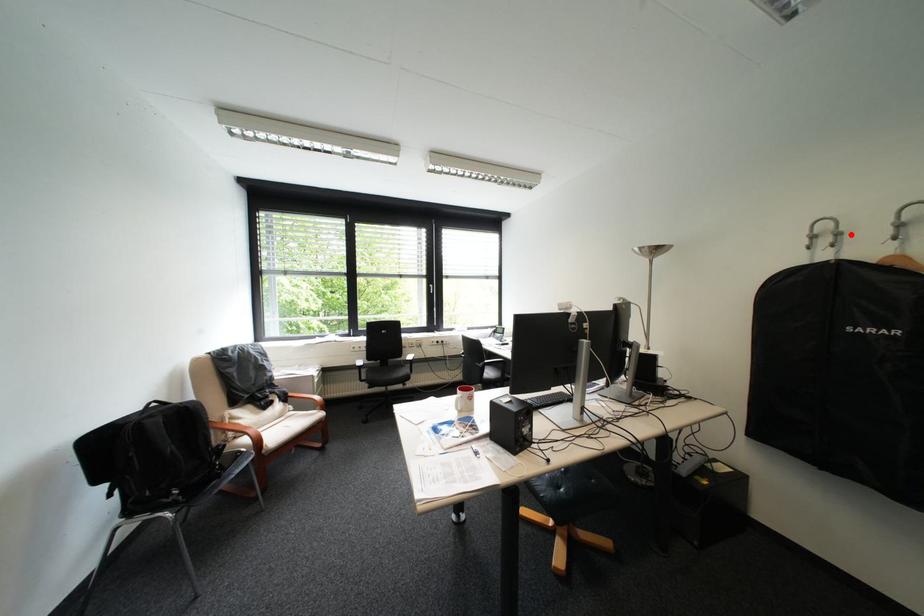
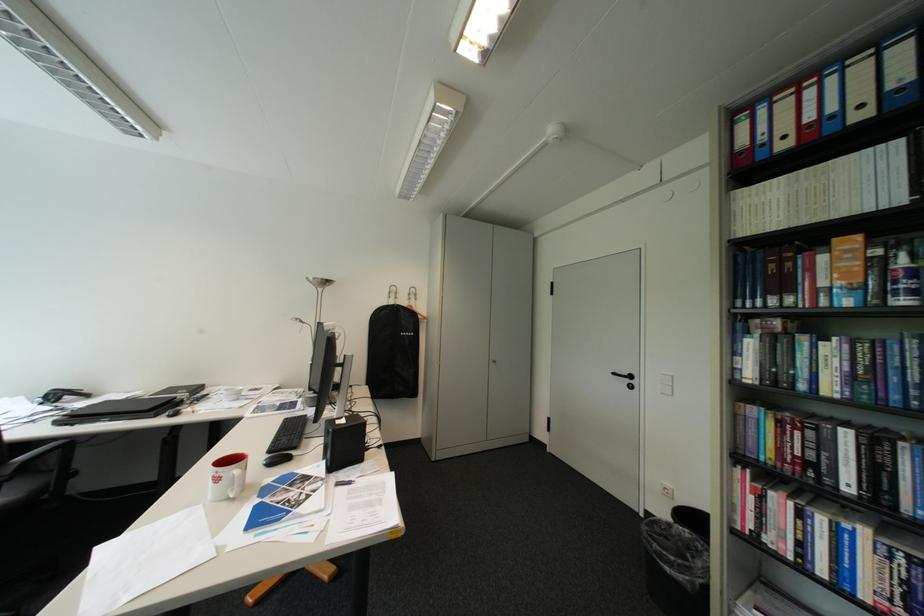
Locate, in the second image, the point that corresponds to the highlighted location in the first image.

(408, 294)